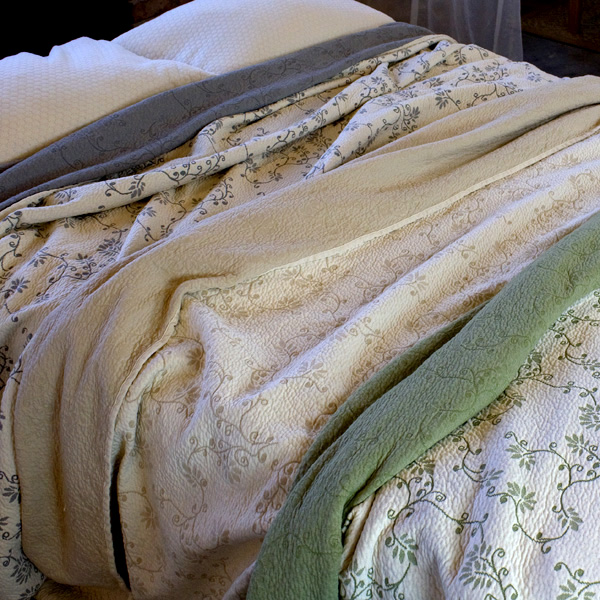
Where is `grey blanket`? grey blanket is located at coordinates (178, 113).